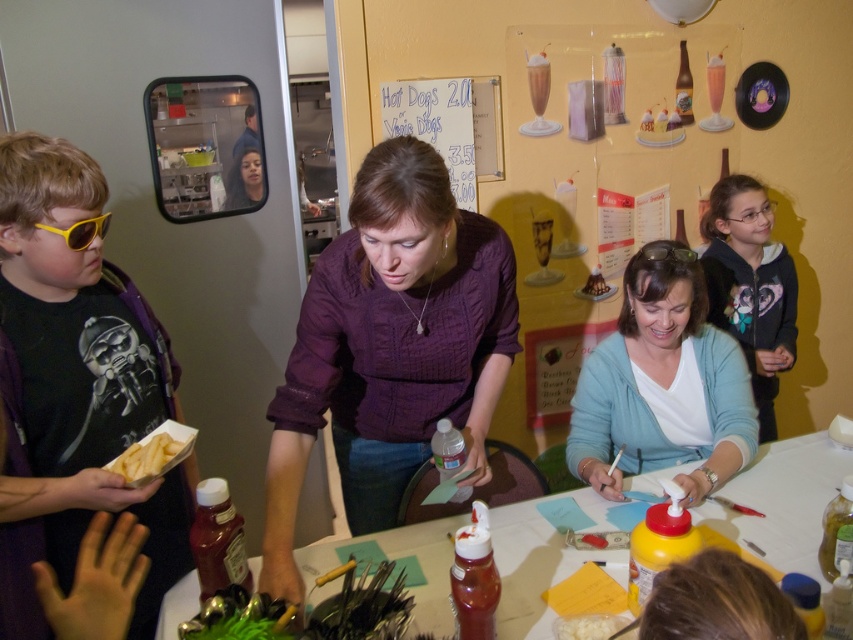
You are standing at the entrance of the dining area and see two points on the table where you want to place a small vase. The points are labeled as point (492, 224) and point (643, 244). According to the scene description, which point is closer to you?

Point (492, 224) is in front of point (643, 244), so the point closer to you is point (492, 224).

You are a guest at this event and want to place a small keychain between the purple knit sweater at center and the black plastic goggles at center. Which object should the keychain be placed closer to if you want it to be closer to the taller object?

The purple knit sweater at center is taller than the black plastic goggles at center. Therefore, placing the keychain closer to the purple knit sweater at center would position it nearer to the taller object.

You are a guest at the event and want to hand a gift to the person wearing the matte black shirt at left without disturbing the person wearing the black plastic goggles at center. How can you approach?

Since the matte black shirt at left is in front of the black plastic goggles at center, you can approach from the side or behind the matte black shirt at left to hand the gift without disturbing the black plastic goggles at center.